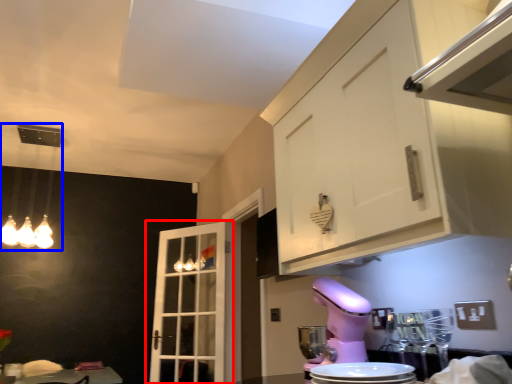
Question: Which object appears farthest to the camera in this image, door (highlighted by a red box) or light fixture (highlighted by a blue box)?

Choices:
 (A) door
 (B) light fixture

Answer: (A)